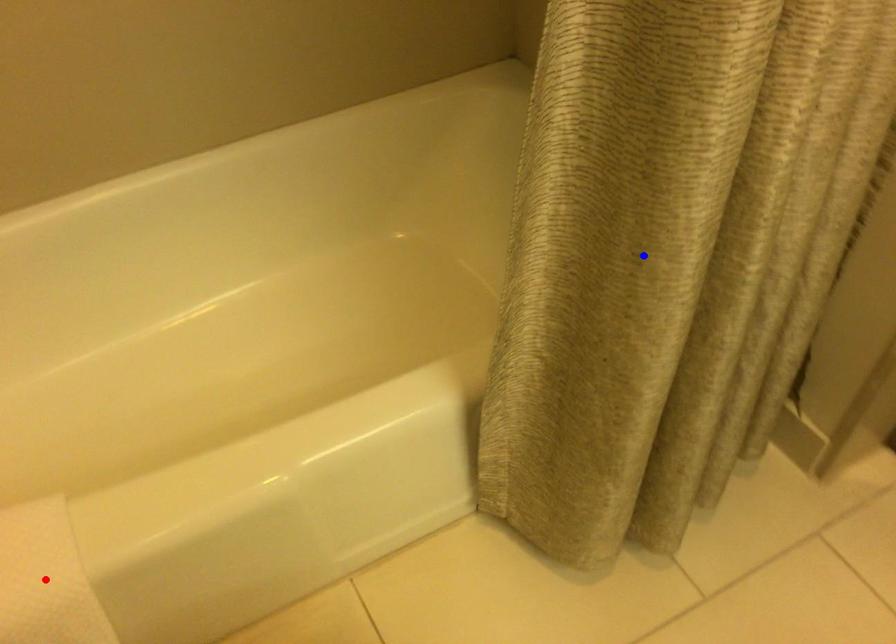
Question: Two points are marked on the image. Which point is closer to the camera?

Choices:
 (A) Blue point is closer.
 (B) Red point is closer.

Answer: (A)